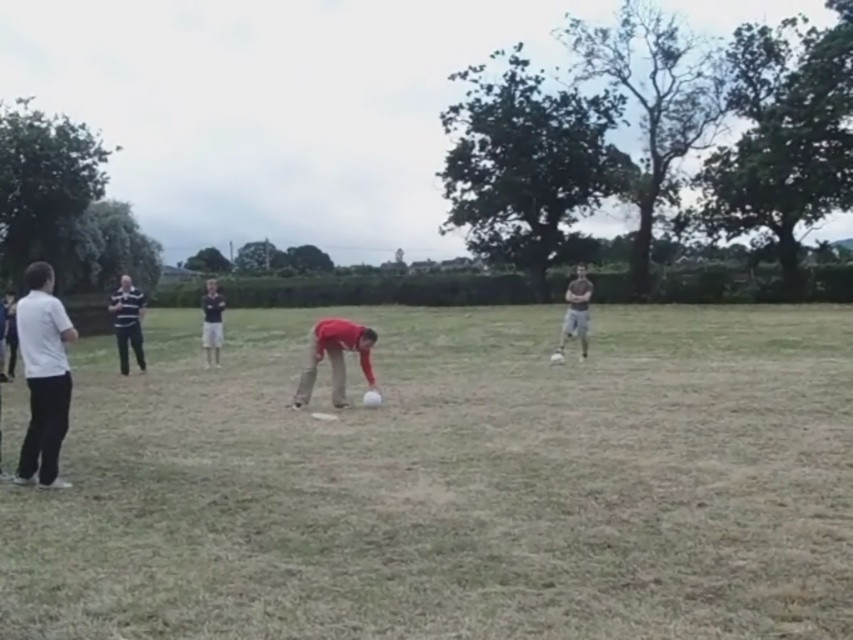
You are a photographer trying to capture a group photo of the people in the scene. You want to ensure that both the white matte shirt at left and the matte red shirt at center are clearly visible in the frame. Based on their positions, which shirt should you focus on to ensure both are in focus?

Since the white matte shirt at left is positioned on the left side of matte red shirt at center, you should focus on the matte red shirt at center as it is closer to the center of the frame, making it easier to include both in the focused area.

You are a photographer trying to capture a group photo of the white matte shirt at left and the matte red shirt at center. Since you want to ensure both subjects are clearly visible, which subject should you focus on to account for their sizes?

The white matte shirt at left is wider than the matte red shirt at center, so focusing on the white matte shirt at left would ensure it is captured clearly due to its larger size.